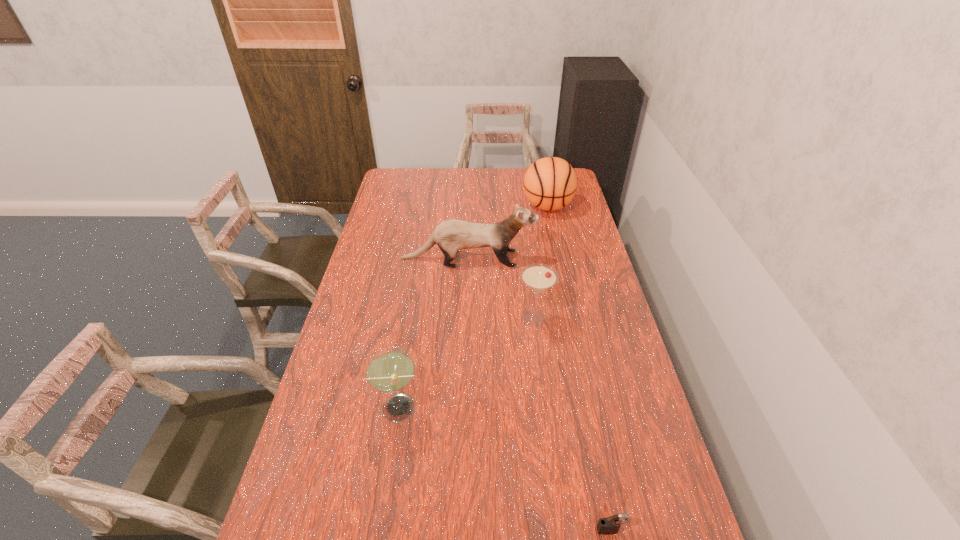
The image size is (960, 540). I want to click on vacant space in between the farther martini and the nearest object, so click(573, 424).

Find the location of a particular element. The width and height of the screenshot is (960, 540). empty space between the ferret and the padlock is located at coordinates (540, 394).

Find the location of a particular element. The image size is (960, 540). vacant area that lies between the farther martini and the shortest object is located at coordinates (573, 424).

Locate an element on the screen. The width and height of the screenshot is (960, 540). empty space between the second nearest object and the basketball is located at coordinates (472, 307).

The width and height of the screenshot is (960, 540). Identify the location of vacant area between the shortest object and the right martini. (573, 424).

Locate an element on the screen. The image size is (960, 540). vacant area that lies between the shortest object and the ferret is located at coordinates (540, 394).

Where is `vacant area between the ferret and the farther martini`? vacant area between the ferret and the farther martini is located at coordinates (501, 288).

The width and height of the screenshot is (960, 540). Find the location of `free point between the ferret and the left martini`. free point between the ferret and the left martini is located at coordinates (433, 333).

Locate which object is the third closest to the second farthest object. Please provide its 2D coordinates. Your answer should be formatted as a tuple, i.e. [(x, y)], where the tuple contains the x and y coordinates of a point satisfying the conditions above.

[(390, 369)]

Where is `the third closest object to the ferret`? The height and width of the screenshot is (540, 960). the third closest object to the ferret is located at coordinates (390, 369).